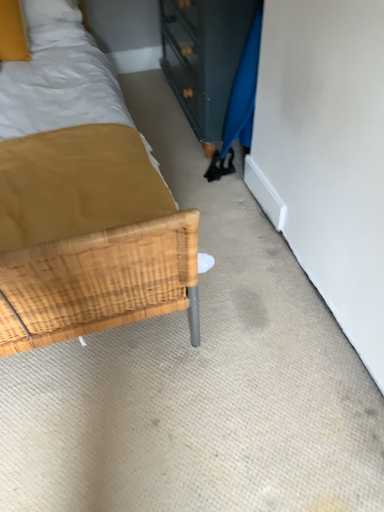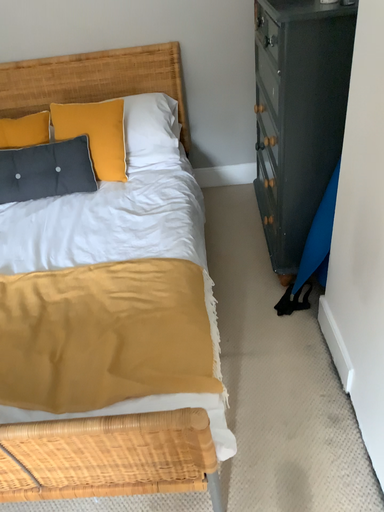
Question: Which way did the camera rotate in the video?

Choices:
 (A) rotated upward
 (B) rotated downward

Answer: (A)